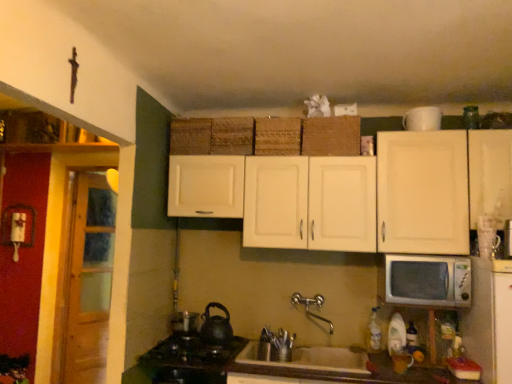
Question: Is woven brown basket at upper center, which is counted as the first basket, starting from the left, located within woven straw basket at center, arranged as the second basket when viewed from the right?

Choices:
 (A) yes
 (B) no

Answer: (B)

Question: From the image's perspective, is woven straw basket at center, which is the 3th basket from left to right, beneath woven brown basket at upper center, the fourth basket from the right?

Choices:
 (A) yes
 (B) no

Answer: (A)

Question: Is woven straw basket at center, arranged as the second basket when viewed from the right, to the right of woven brown basket at upper center, which is counted as the first basket, starting from the left, from the viewer's perspective?

Choices:
 (A) no
 (B) yes

Answer: (B)

Question: Does woven straw basket at center, arranged as the second basket when viewed from the right, have a greater width compared to woven brown basket at upper center, which is counted as the first basket, starting from the left?

Choices:
 (A) no
 (B) yes

Answer: (A)

Question: Is woven straw basket at center, which is the 3th basket from left to right, shorter than woven brown basket at upper center, which is counted as the first basket, starting from the left?

Choices:
 (A) yes
 (B) no

Answer: (A)

Question: Is woven brown basket at center, acting as the second basket starting from the left, situated inside white matte cabinet at upper center or outside?

Choices:
 (A) inside
 (B) outside

Answer: (A)

Question: Does point (251, 150) appear closer or farther from the camera than point (434, 182)?

Choices:
 (A) closer
 (B) farther

Answer: (B)

Question: In the image, is woven brown basket at center, the 3th basket when ordered from right to left, on the left side or the right side of white matte cabinet at upper center?

Choices:
 (A) right
 (B) left

Answer: (B)

Question: Considering the positions of woven brown basket at center, the 3th basket when ordered from right to left, and white matte cabinet at upper center in the image, is woven brown basket at center, the 3th basket when ordered from right to left, wider or thinner than white matte cabinet at upper center?

Choices:
 (A) thin
 (B) wide

Answer: (A)

Question: Based on their sizes in the image, would you say white matte cabinet at upper center is bigger or smaller than black matte tea pot at lower center?

Choices:
 (A) small
 (B) big

Answer: (B)

Question: Visually, is white matte cabinet at upper center positioned to the left or to the right of black matte tea pot at lower center?

Choices:
 (A) left
 (B) right

Answer: (B)

Question: From a real-world perspective, is white matte cabinet at upper center above or below black matte tea pot at lower center?

Choices:
 (A) below
 (B) above

Answer: (B)

Question: Is point (356, 205) positioned closer to the camera than point (228, 322)?

Choices:
 (A) closer
 (B) farther

Answer: (A)

Question: In the image, is wooden at left on the left side or the right side of brown woven basket at upper center, which is counted as the first basket, starting from the right?

Choices:
 (A) right
 (B) left

Answer: (B)

Question: From their relative heights in the image, would you say wooden at left is taller or shorter than brown woven basket at upper center, which is counted as the first basket, starting from the right?

Choices:
 (A) tall
 (B) short

Answer: (A)